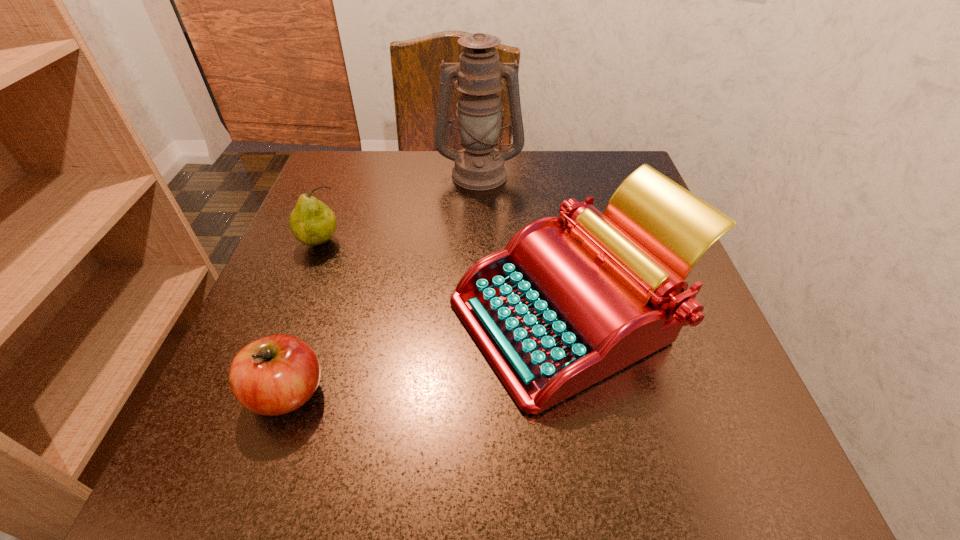
Select which object appears as the second closest to the typewriter. Please provide its 2D coordinates. Your answer should be formatted as a tuple, i.e. [(x, y)], where the tuple contains the x and y coordinates of a point satisfying the conditions above.

[(479, 166)]

This screenshot has width=960, height=540. In order to click on vacant region that satisfies the following two spatial constraints: 1. on the back side of the pear; 2. on the left side of the oil lamp in this screenshot , I will do `click(348, 173)`.